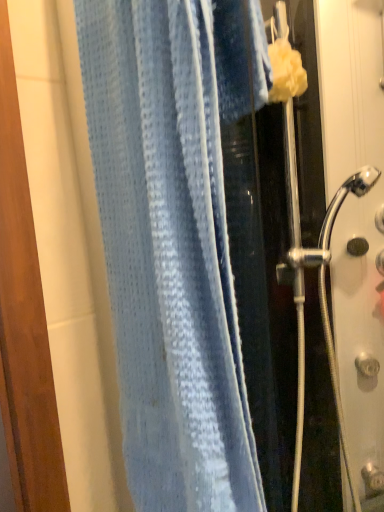
Question: Should I look upward or downward to see blue waffle-textured towel at center?

Choices:
 (A) up
 (B) down

Answer: (B)

Question: Is the depth of blue waffle-textured towel at center greater than that of clear glass shower door at right?

Choices:
 (A) yes
 (B) no

Answer: (B)

Question: Considering the relative sizes of blue waffle-textured towel at center and clear glass shower door at right in the image provided, is blue waffle-textured towel at center bigger than clear glass shower door at right?

Choices:
 (A) no
 (B) yes

Answer: (A)

Question: From the image's perspective, is blue waffle-textured towel at center on top of clear glass shower door at right?

Choices:
 (A) no
 (B) yes

Answer: (B)

Question: Is blue waffle-textured towel at center positioned beyond the bounds of clear glass shower door at right?

Choices:
 (A) yes
 (B) no

Answer: (A)

Question: Considering the relative sizes of blue waffle-textured towel at center and clear glass shower door at right in the image provided, is blue waffle-textured towel at center taller than clear glass shower door at right?

Choices:
 (A) no
 (B) yes

Answer: (A)

Question: Considering the relative positions of blue waffle-textured towel at center and clear glass shower door at right in the image provided, is blue waffle-textured towel at center to the right of clear glass shower door at right from the viewer's perspective?

Choices:
 (A) yes
 (B) no

Answer: (B)

Question: Considering the relative sizes of clear glass shower door at right and blue waffle-textured towel at center in the image provided, is clear glass shower door at right smaller than blue waffle-textured towel at center?

Choices:
 (A) no
 (B) yes

Answer: (A)

Question: Would you say clear glass shower door at right is outside blue waffle-textured towel at center?

Choices:
 (A) no
 (B) yes

Answer: (B)

Question: From a real-world perspective, is clear glass shower door at right physically below blue waffle-textured towel at center?

Choices:
 (A) yes
 (B) no

Answer: (A)

Question: From the image's perspective, is clear glass shower door at right over blue waffle-textured towel at center?

Choices:
 (A) yes
 (B) no

Answer: (B)

Question: Does clear glass shower door at right come behind blue waffle-textured towel at center?

Choices:
 (A) yes
 (B) no

Answer: (A)

Question: Is blue waffle-textured towel at center a part of clear glass shower door at right?

Choices:
 (A) no
 (B) yes

Answer: (A)

Question: Is clear glass shower door at right inside or outside of blue waffle-textured towel at center?

Choices:
 (A) outside
 (B) inside

Answer: (A)